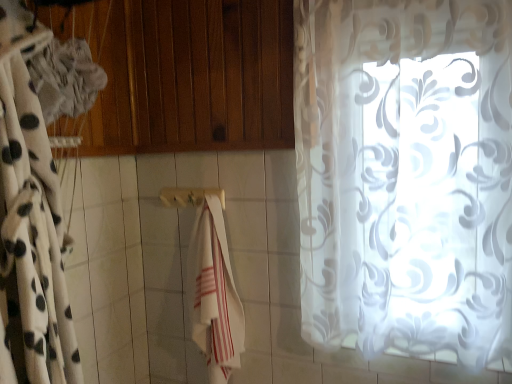
Describe the element at coordinates (189, 196) in the screenshot. I see `wooden towel bar at center` at that location.

Describe the element at coordinates (405, 175) in the screenshot. I see `transparent floral-patterned curtain at right, which appears as the 2th curtain when viewed from the left` at that location.

This screenshot has height=384, width=512. Describe the element at coordinates (30, 222) in the screenshot. I see `white sheer curtain at left, placed as the 1th curtain when sorted from left to right` at that location.

In order to face white sheer curtain at left, placed as the 1th curtain when sorted from left to right, should I rotate leftwards or rightwards?

To align with it, rotate left about 30.544°.

I want to click on white cotton towel at center, so click(214, 294).

At what (x,y) coordinates should I click in order to perform the action: click on wooden towel bar at center. Please return your answer as a coordinate pair (x, y). Image resolution: width=512 pixels, height=384 pixels. Looking at the image, I should click on (189, 196).

Visually, is transparent floral-patterned curtain at right, which appears as the 2th curtain when viewed from the left, positioned to the left or to the right of wooden towel bar at center?

In the image, transparent floral-patterned curtain at right, which appears as the 2th curtain when viewed from the left, appears on the right side of wooden towel bar at center.

Is point (431, 137) positioned behind point (183, 189)?

No, it is not.

Which of these two, transparent floral-patterned curtain at right, arranged as the first curtain when viewed from the right, or wooden towel bar at center, is bigger?

Bigger between the two is transparent floral-patterned curtain at right, arranged as the first curtain when viewed from the right.

From the image's perspective, who appears lower, transparent floral-patterned curtain at right, which appears as the 2th curtain when viewed from the left, or wooden towel bar at center?

wooden towel bar at center appears lower in the image.

From a real-world perspective, does wooden towel bar at center stand above white sheer curtain at left, placed as the 1th curtain when sorted from left to right?

Incorrect, from a real-world perspective, wooden towel bar at center is lower than white sheer curtain at left, placed as the 1th curtain when sorted from left to right.

Does point (190, 198) come behind point (7, 100)?

Yes, point (190, 198) is behind point (7, 100).

Considering the positions of objects wooden towel bar at center and white sheer curtain at left, the second curtain viewed from the right, in the image provided, who is more to the left, wooden towel bar at center or white sheer curtain at left, the second curtain viewed from the right,?

From the viewer's perspective, white sheer curtain at left, the second curtain viewed from the right, appears more on the left side.

From the picture: How much distance is there between wooden towel bar at center and white sheer curtain at left, the second curtain viewed from the right?

50.81 centimeters.

Is point (189, 204) behind point (204, 224)?

That is True.

In the scene shown: Considering the relative sizes of wooden towel bar at center and white cotton towel at center in the image provided, is wooden towel bar at center bigger than white cotton towel at center?

No.

Which of these two, wooden towel bar at center or white cotton towel at center, stands taller?

Standing taller between the two is white cotton towel at center.

Is wooden towel bar at center closer to the viewer compared to white cotton towel at center?

No, wooden towel bar at center is further to the viewer.

In terms of size, does white sheer curtain at left, the second curtain viewed from the right, appear bigger or smaller than transparent floral-patterned curtain at right, which appears as the 2th curtain when viewed from the left?

Clearly, white sheer curtain at left, the second curtain viewed from the right, is smaller in size than transparent floral-patterned curtain at right, which appears as the 2th curtain when viewed from the left.

Is point (0, 81) closer to viewer compared to point (418, 97)?

Yes, point (0, 81) is closer to viewer.

From a real-world perspective, between white sheer curtain at left, placed as the 1th curtain when sorted from left to right, and transparent floral-patterned curtain at right, arranged as the first curtain when viewed from the right, who is vertically higher?

transparent floral-patterned curtain at right, arranged as the first curtain when viewed from the right.

Where is `curtain that is in front of the transparent floral-patterned curtain at right, which appears as the 2th curtain when viewed from the left`? curtain that is in front of the transparent floral-patterned curtain at right, which appears as the 2th curtain when viewed from the left is located at coordinates (30, 222).

From the image's perspective, does transparent floral-patterned curtain at right, arranged as the first curtain when viewed from the right, appear higher than white cotton towel at center?

Yes, from the image's perspective, transparent floral-patterned curtain at right, arranged as the first curtain when viewed from the right, is on top of white cotton towel at center.

Considering the positions of point (436, 84) and point (211, 367), is point (436, 84) closer or farther from the camera than point (211, 367)?

Point (436, 84).

From a real-world perspective, count 2nd curtains upward from the white cotton towel at center and point to it. Please provide its 2D coordinates.

[(405, 175)]

Are transparent floral-patterned curtain at right, arranged as the first curtain when viewed from the right, and white cotton towel at center making contact?

No, transparent floral-patterned curtain at right, arranged as the first curtain when viewed from the right, is not making contact with white cotton towel at center.

From a real-world perspective, who is located higher, transparent floral-patterned curtain at right, which appears as the 2th curtain when viewed from the left, or white sheer curtain at left, the second curtain viewed from the right?

transparent floral-patterned curtain at right, which appears as the 2th curtain when viewed from the left, from a real-world perspective.

Considering the sizes of objects transparent floral-patterned curtain at right, arranged as the first curtain when viewed from the right, and white sheer curtain at left, placed as the 1th curtain when sorted from left to right, in the image provided, who is bigger, transparent floral-patterned curtain at right, arranged as the first curtain when viewed from the right, or white sheer curtain at left, placed as the 1th curtain when sorted from left to right,?

Bigger between the two is transparent floral-patterned curtain at right, arranged as the first curtain when viewed from the right.

Are transparent floral-patterned curtain at right, which appears as the 2th curtain when viewed from the left, and white sheer curtain at left, the second curtain viewed from the right, far apart?

No, there isn't a large distance between transparent floral-patterned curtain at right, which appears as the 2th curtain when viewed from the left, and white sheer curtain at left, the second curtain viewed from the right.

Considering the points (445, 43) and (6, 112), which point is behind, point (445, 43) or point (6, 112)?

The point (445, 43) is more distant.

Are white sheer curtain at left, placed as the 1th curtain when sorted from left to right, and white cotton towel at center located far from each other?

Actually, white sheer curtain at left, placed as the 1th curtain when sorted from left to right, and white cotton towel at center are a little close together.

From the picture: Which is in front, white sheer curtain at left, the second curtain viewed from the right, or white cotton towel at center?

white sheer curtain at left, the second curtain viewed from the right.

Is white sheer curtain at left, placed as the 1th curtain when sorted from left to right, positioned with its back to white cotton towel at center?

No, white sheer curtain at left, placed as the 1th curtain when sorted from left to right, is not facing away from white cotton towel at center.

Looking at their sizes, would you say white sheer curtain at left, placed as the 1th curtain when sorted from left to right, is wider or thinner than white cotton towel at center?

Considering their sizes, white sheer curtain at left, placed as the 1th curtain when sorted from left to right, looks broader than white cotton towel at center.

Where is `the 2nd curtain positioned above the wooden towel bar at center (from a real-world perspective)`? This screenshot has height=384, width=512. the 2nd curtain positioned above the wooden towel bar at center (from a real-world perspective) is located at coordinates (405, 175).

This screenshot has height=384, width=512. What are the coordinates of `towel bar that appears behind the white sheer curtain at left, the second curtain viewed from the right` in the screenshot? It's located at (189, 196).

Consider the image. Looking at the image, which one is located closer to white cotton towel at center, wooden towel bar at center or transparent floral-patterned curtain at right, which appears as the 2th curtain when viewed from the left?

wooden towel bar at center lies closer to white cotton towel at center than the other object.

Estimate the real-world distances between objects in this image. Which object is closer to transparent floral-patterned curtain at right, arranged as the first curtain when viewed from the right, white sheer curtain at left, placed as the 1th curtain when sorted from left to right, or white cotton towel at center?

white cotton towel at center is positioned closer to the anchor transparent floral-patterned curtain at right, arranged as the first curtain when viewed from the right.

Looking at the image, which one is located further to wooden towel bar at center, transparent floral-patterned curtain at right, which appears as the 2th curtain when viewed from the left, or white sheer curtain at left, placed as the 1th curtain when sorted from left to right?

The object further to wooden towel bar at center is transparent floral-patterned curtain at right, which appears as the 2th curtain when viewed from the left.

Considering their positions, is white sheer curtain at left, placed as the 1th curtain when sorted from left to right, positioned closer to wooden towel bar at center than transparent floral-patterned curtain at right, arranged as the first curtain when viewed from the right?

Among the two, white sheer curtain at left, placed as the 1th curtain when sorted from left to right, is located nearer to wooden towel bar at center.

Considering their positions, is white cotton towel at center positioned closer to transparent floral-patterned curtain at right, which appears as the 2th curtain when viewed from the left, than wooden towel bar at center?

Based on the image, white cotton towel at center appears to be nearer to transparent floral-patterned curtain at right, which appears as the 2th curtain when viewed from the left.

Looking at this image, looking at the image, which one is located closer to white cotton towel at center, white sheer curtain at left, placed as the 1th curtain when sorted from left to right, or transparent floral-patterned curtain at right, which appears as the 2th curtain when viewed from the left?

white sheer curtain at left, placed as the 1th curtain when sorted from left to right, lies closer to white cotton towel at center than the other object.

Looking at the image, which one is located closer to transparent floral-patterned curtain at right, arranged as the first curtain when viewed from the right, wooden towel bar at center or white cotton towel at center?

Based on the image, white cotton towel at center appears to be nearer to transparent floral-patterned curtain at right, arranged as the first curtain when viewed from the right.

Considering their positions, is transparent floral-patterned curtain at right, arranged as the first curtain when viewed from the right, positioned closer to white cotton towel at center than white sheer curtain at left, placed as the 1th curtain when sorted from left to right?

white sheer curtain at left, placed as the 1th curtain when sorted from left to right.

Identify the location of beach towel positioned between white sheer curtain at left, placed as the 1th curtain when sorted from left to right, and wooden towel bar at center from near to far. Image resolution: width=512 pixels, height=384 pixels. (214, 294).

The height and width of the screenshot is (384, 512). Identify the location of beach towel located between white sheer curtain at left, the second curtain viewed from the right, and transparent floral-patterned curtain at right, arranged as the first curtain when viewed from the right, in the left-right direction. point(214,294).

Identify the location of towel bar between white sheer curtain at left, placed as the 1th curtain when sorted from left to right, and transparent floral-patterned curtain at right, which appears as the 2th curtain when viewed from the left, in the horizontal direction. (189, 196).

You are a GUI agent. You are given a task and a screenshot of the screen. Output one action in this format:
    pyautogui.click(x=<x>, y=<y>)
    Task: Click on the beach towel between wooden towel bar at center and transparent floral-patterned curtain at right, arranged as the first curtain when viewed from the right, from left to right
    This screenshot has width=512, height=384.
    Given the screenshot: What is the action you would take?
    pyautogui.click(x=214, y=294)